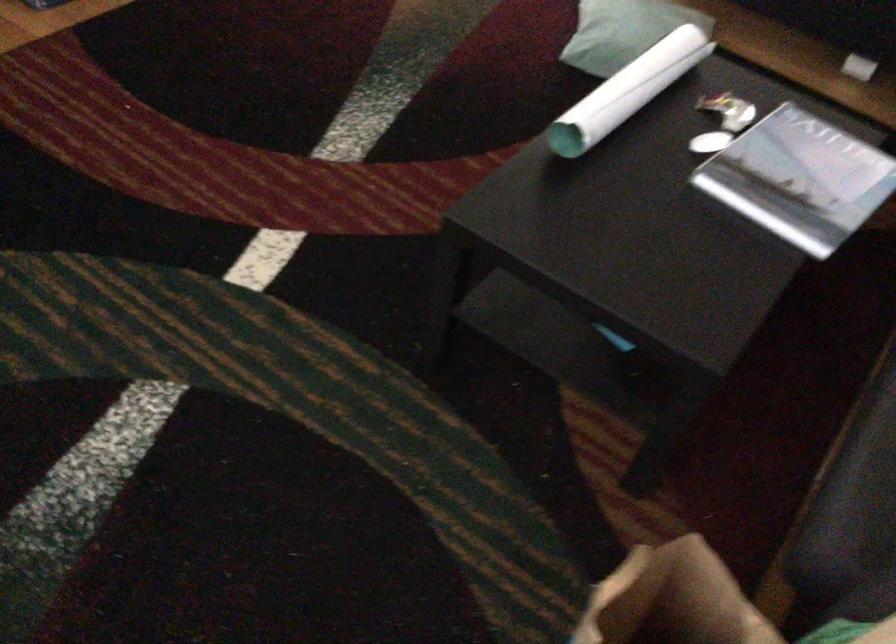
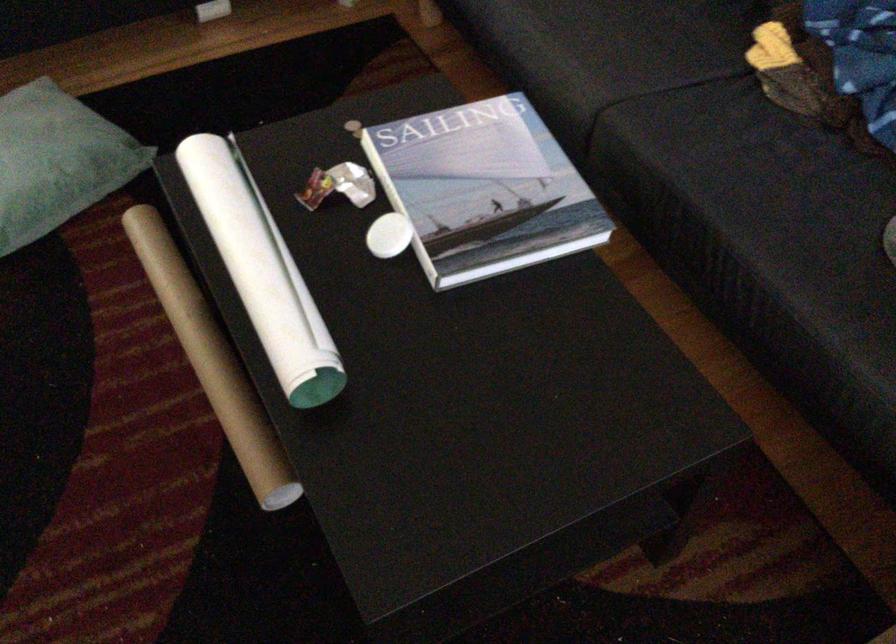
Locate, in the second image, the point that corresponds to point (705, 142) in the first image.

(389, 236)